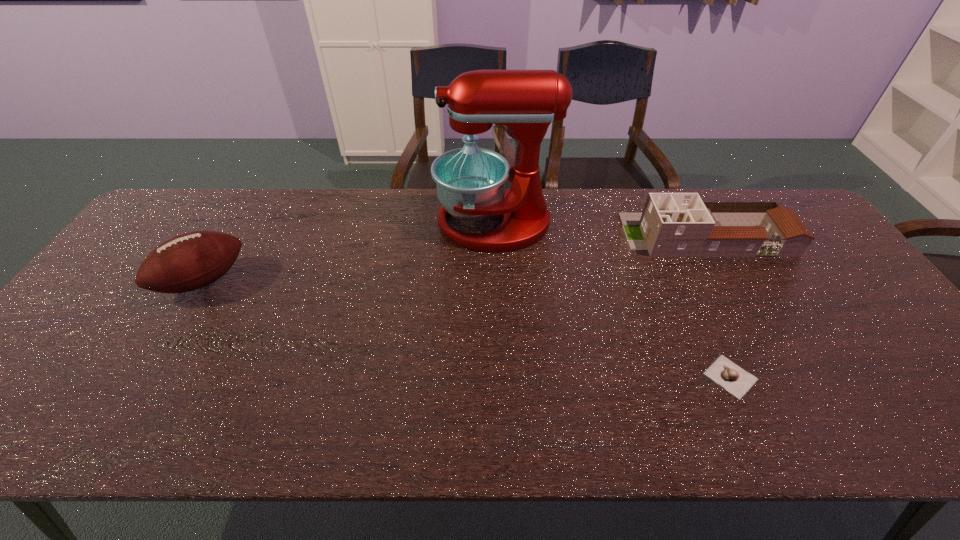
This screenshot has width=960, height=540. I want to click on blank space located at the main entrance of the dollhouse, so pos(495,234).

Locate an element on the screen. This screenshot has height=540, width=960. free spot located at the main entrance of the dollhouse is located at coordinates (495, 234).

The height and width of the screenshot is (540, 960). In order to click on free spot located 0.240m at the main entrance of the dollhouse in this screenshot , I will do `click(547, 234)`.

The image size is (960, 540). Find the location of `free space located on the right of the football (American)`. free space located on the right of the football (American) is located at coordinates click(275, 281).

Where is `blank space located on the left of the nearest object`? This screenshot has width=960, height=540. blank space located on the left of the nearest object is located at coordinates (589, 377).

Where is `mixer that is at the far edge`? The height and width of the screenshot is (540, 960). mixer that is at the far edge is located at coordinates (470, 181).

Find the location of a particular element. dollhouse positioned at the far edge is located at coordinates (672, 224).

What are the coordinates of `object at the right edge` in the screenshot? It's located at (672, 224).

In order to click on object that is at the far right corner in this screenshot , I will do `click(672, 224)`.

Locate an element on the screen. Image resolution: width=960 pixels, height=540 pixels. vacant space at the far edge of the desktop is located at coordinates (414, 190).